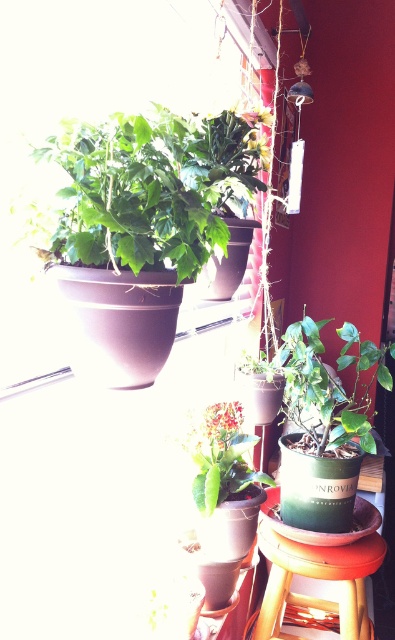
Who is more forward, (159, 180) or (205, 492)?

Point (159, 180) is in front.

Does matte brown pot at upper left come behind green matte plant at center?

No.

This screenshot has width=395, height=640. Describe the element at coordinates (152, 188) in the screenshot. I see `matte brown pot at upper left` at that location.

The width and height of the screenshot is (395, 640). I want to click on matte brown pot at upper left, so click(x=152, y=188).

Can you confirm if wooden stool at lower center is positioned above green matte plant at center?

Incorrect, wooden stool at lower center is not positioned above green matte plant at center.

Who is positioned more to the left, wooden stool at lower center or green matte plant at center?

green matte plant at center

Describe the element at coordinates (317, 579) in the screenshot. Image resolution: width=395 pixels, height=640 pixels. I see `wooden stool at lower center` at that location.

This screenshot has height=640, width=395. What are the coordinates of `wooden stool at lower center` in the screenshot? It's located at (317, 579).

Who is positioned more to the right, green matte plant at lower right or wooden stool at lower center?

Positioned to the right is green matte plant at lower right.

Does green matte plant at lower right appear over wooden stool at lower center?

Yes.

Which is behind, point (297, 420) or point (319, 561)?

The point (297, 420) is more distant.

Identify the location of green matte plant at lower right. (329, 384).